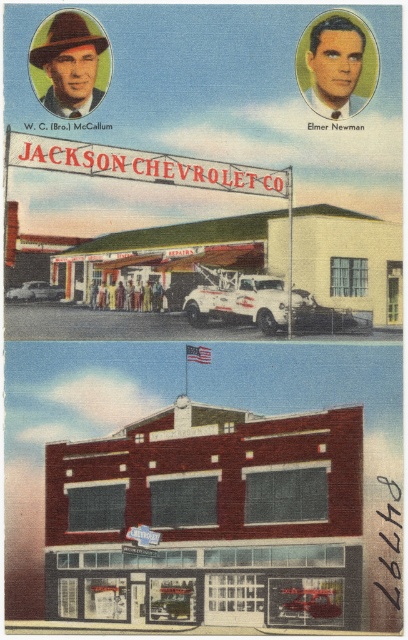
Is point (164, 524) less distant than point (73, 86)?

Yes.

Who is more distant from viewer, (261,582) or (40,48)?

The point (40,48) is behind.

In order to click on brick building at center in this screenshot , I will do `click(208, 518)`.

Can you confirm if matte brown hat at upper left is bigger than smooth skin face at upper right?

Correct, matte brown hat at upper left is larger in size than smooth skin face at upper right.

Which is in front, point (31, 54) or point (319, 77)?

Point (319, 77)

You are a GUI agent. You are given a task and a screenshot of the screen. Output one action in this format:
    pyautogui.click(x=<x>, y=<y>)
    Task: Click on the matte brown hat at upper left
    The width and height of the screenshot is (408, 640).
    Given the screenshot: What is the action you would take?
    pyautogui.click(x=70, y=65)

Can you confirm if brick building at center is bigger than smooth skin face at upper right?

Indeed, brick building at center has a larger size compared to smooth skin face at upper right.

Which is more to the right, brick building at center or smooth skin face at upper right?

Positioned to the right is smooth skin face at upper right.

Does point (297, 436) lie behind point (310, 58)?

No, (297, 436) is closer to viewer.

The height and width of the screenshot is (640, 408). What are the coordinates of `brick building at center` in the screenshot? It's located at (208, 518).